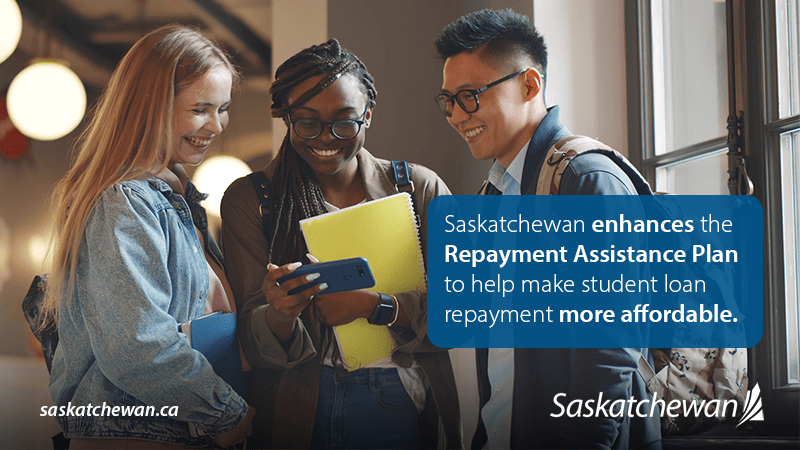
You are a GUI agent. You are given a task and a screenshot of the screen. Output one action in this format:
    pyautogui.click(x=<x>, y=<y>)
    Task: Click on the lights
    This screenshot has width=800, height=450.
    Given the screenshot: What is the action you would take?
    pyautogui.click(x=26, y=81), pyautogui.click(x=0, y=23), pyautogui.click(x=209, y=186)